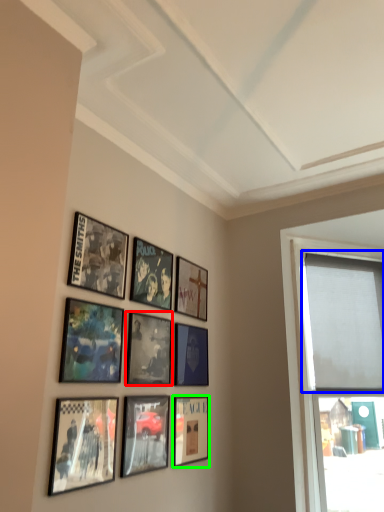
Question: Which object is positioned farthest from picture frame (highlighted by a red box)? Select from window screen (highlighted by a blue box) and picture frame (highlighted by a green box).

Choices:
 (A) window screen
 (B) picture frame

Answer: (A)